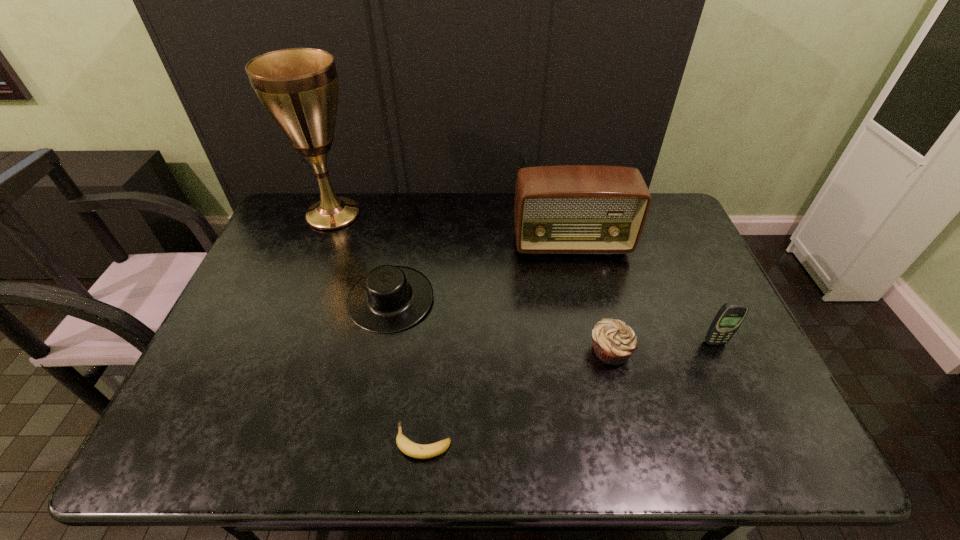
In order to click on the leftmost object in this screenshot , I will do 298,87.

Identify the location of trophy cup. (298, 87).

Find the location of a particular element. Image resolution: width=960 pixels, height=540 pixels. the second tallest object is located at coordinates (565, 209).

Find the location of a particular element. The height and width of the screenshot is (540, 960). the fourth shortest object is located at coordinates (728, 319).

This screenshot has height=540, width=960. What are the coordinates of `cellular telephone` in the screenshot? It's located at (728, 319).

The width and height of the screenshot is (960, 540). Find the location of `dress hat`. dress hat is located at coordinates (389, 299).

Image resolution: width=960 pixels, height=540 pixels. I want to click on muffin, so pyautogui.click(x=614, y=341).

I want to click on the shortest object, so coord(414,450).

Find the location of `the nearest object`. the nearest object is located at coordinates (414, 450).

Where is `free space located on the right of the leftmost object`? This screenshot has width=960, height=540. free space located on the right of the leftmost object is located at coordinates (409, 214).